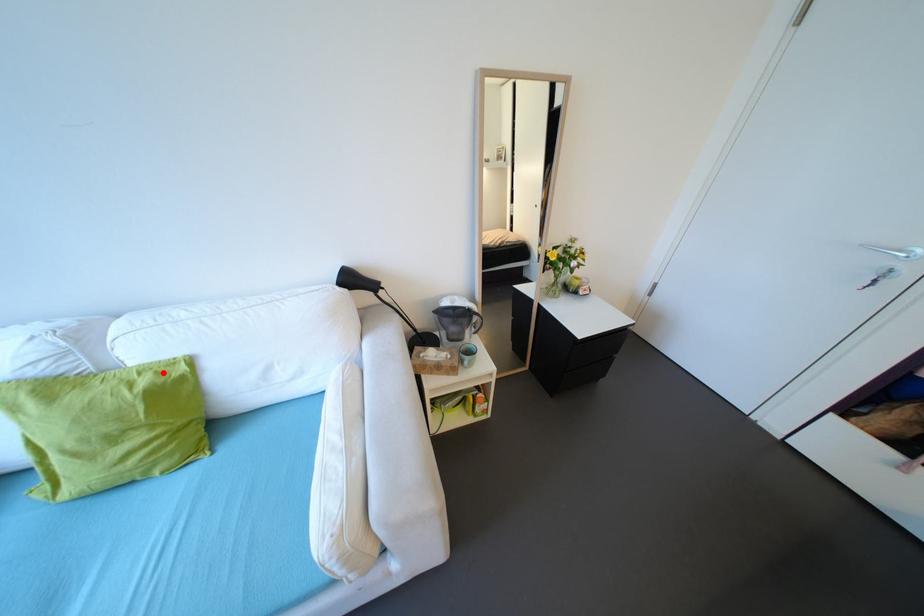
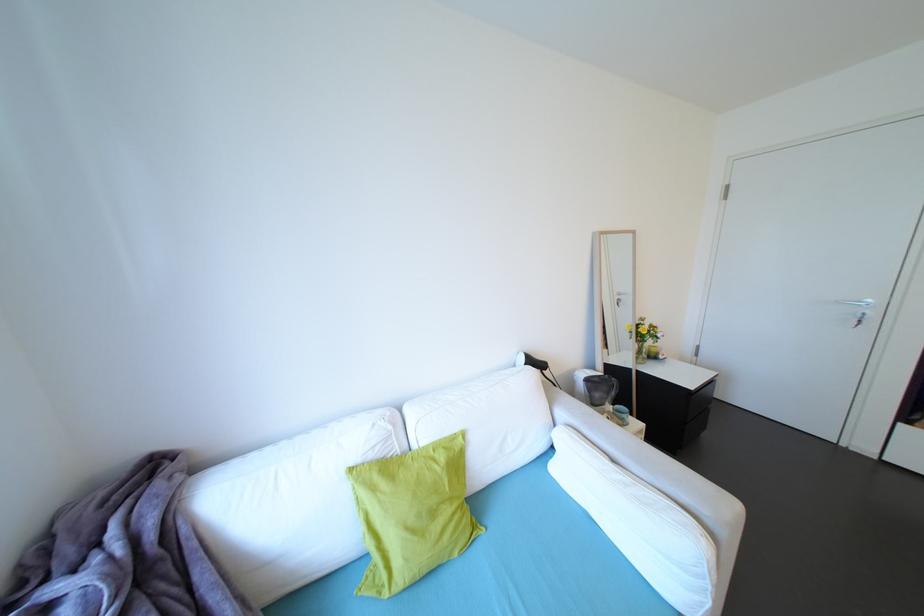
In the second image, find the point that corresponds to the highlighted location in the first image.

(451, 448)